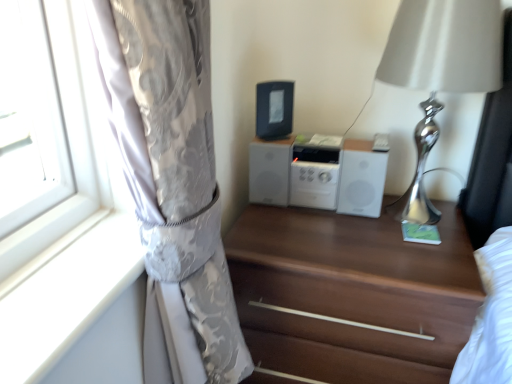
Question: Would you say silky silver curtain at left is outside white matte stereo at center?

Choices:
 (A) yes
 (B) no

Answer: (A)

Question: Are silky silver curtain at left and white matte stereo at center far apart?

Choices:
 (A) no
 (B) yes

Answer: (A)

Question: From the image's perspective, does silky silver curtain at left appear lower than white matte stereo at center?

Choices:
 (A) yes
 (B) no

Answer: (A)

Question: Considering the relative positions of silky silver curtain at left and white matte stereo at center in the image provided, is silky silver curtain at left in front of white matte stereo at center?

Choices:
 (A) no
 (B) yes

Answer: (B)

Question: Considering the relative positions of silky silver curtain at left and white matte stereo at center in the image provided, is silky silver curtain at left to the right of white matte stereo at center from the viewer's perspective?

Choices:
 (A) no
 (B) yes

Answer: (A)

Question: Is silky silver curtain at left smaller than white matte stereo at center?

Choices:
 (A) no
 (B) yes

Answer: (A)

Question: Is the surface of silver metallic table lamp at right in direct contact with silky silver curtain at left?

Choices:
 (A) no
 (B) yes

Answer: (A)

Question: Is silver metallic table lamp at right closer to the viewer compared to silky silver curtain at left?

Choices:
 (A) yes
 (B) no

Answer: (B)

Question: From the image's perspective, is silver metallic table lamp at right over silky silver curtain at left?

Choices:
 (A) yes
 (B) no

Answer: (A)

Question: From the image's perspective, is silver metallic table lamp at right under silky silver curtain at left?

Choices:
 (A) yes
 (B) no

Answer: (B)

Question: Can you confirm if silver metallic table lamp at right is taller than silky silver curtain at left?

Choices:
 (A) no
 (B) yes

Answer: (A)

Question: Can you confirm if silver metallic table lamp at right is smaller than silky silver curtain at left?

Choices:
 (A) yes
 (B) no

Answer: (A)

Question: Is brown wood chest of drawers at center at the right side of black plastic radio at center?

Choices:
 (A) yes
 (B) no

Answer: (A)